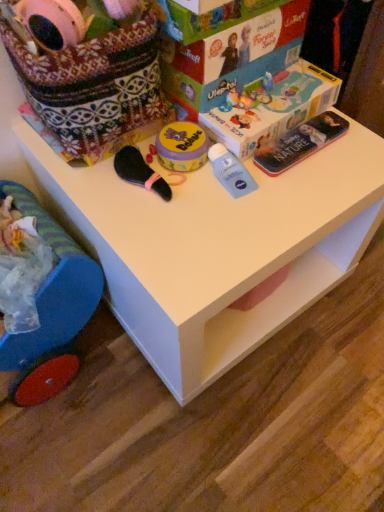
Question: Is blue plastic toy at lower left not within matte cardboard box at upper center?

Choices:
 (A) no
 (B) yes

Answer: (B)

Question: Would you consider blue plastic toy at lower left to be distant from matte cardboard box at upper center?

Choices:
 (A) no
 (B) yes

Answer: (A)

Question: Are blue plastic toy at lower left and matte cardboard box at upper center beside each other?

Choices:
 (A) no
 (B) yes

Answer: (A)

Question: Is blue plastic toy at lower left looking in the opposite direction of matte cardboard box at upper center?

Choices:
 (A) yes
 (B) no

Answer: (A)

Question: Can you confirm if blue plastic toy at lower left is shorter than matte cardboard box at upper center?

Choices:
 (A) no
 (B) yes

Answer: (A)

Question: Based on their sizes in the image, would you say matte cardboard box at upper center is bigger or smaller than blue plastic toy at lower left?

Choices:
 (A) big
 (B) small

Answer: (A)

Question: From the image's perspective, is matte cardboard box at upper center located above or below blue plastic toy at lower left?

Choices:
 (A) above
 (B) below

Answer: (A)

Question: Relative to blue plastic toy at lower left, is matte cardboard box at upper center in front or behind?

Choices:
 (A) front
 (B) behind

Answer: (B)

Question: Does point (299, 3) appear closer or farther from the camera than point (41, 287)?

Choices:
 (A) closer
 (B) farther

Answer: (B)

Question: From a real-world perspective, is blue plastic toy at lower left above or below matte plastic magazine at upper right?

Choices:
 (A) below
 (B) above

Answer: (A)

Question: Is blue plastic toy at lower left bigger or smaller than matte plastic magazine at upper right?

Choices:
 (A) big
 (B) small

Answer: (A)

Question: Is blue plastic toy at lower left taller or shorter than matte plastic magazine at upper right?

Choices:
 (A) tall
 (B) short

Answer: (A)

Question: Is blue plastic toy at lower left wider or thinner than matte plastic magazine at upper right?

Choices:
 (A) thin
 (B) wide

Answer: (B)

Question: From the image's perspective, is white plastic table at center located above or below matte cardboard box at upper center?

Choices:
 (A) below
 (B) above

Answer: (A)

Question: From a real-world perspective, is white plastic table at center positioned above or below matte cardboard box at upper center?

Choices:
 (A) above
 (B) below

Answer: (B)